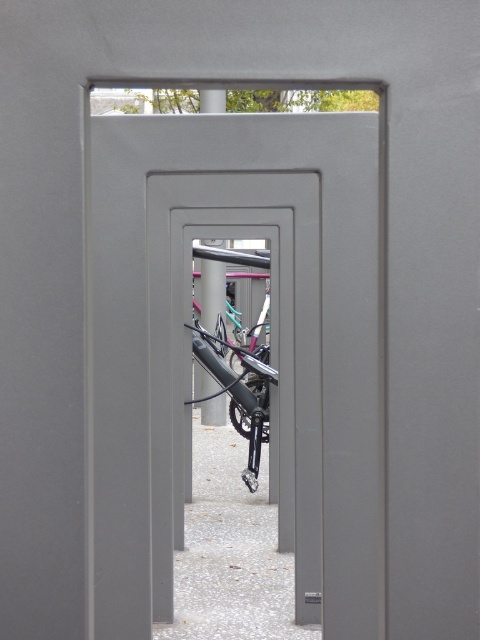
Does shiny metallic bicycle at center come in front of matte black bike at center?

Yes, shiny metallic bicycle at center is closer to the viewer.

Is shiny metallic bicycle at center wider than matte black bike at center?

Yes, shiny metallic bicycle at center is wider than matte black bike at center.

Who is more forward, (254, 444) or (217, 416)?

Positioned in front is point (254, 444).

Locate an element on the screen. This screenshot has height=640, width=480. shiny metallic bicycle at center is located at coordinates (240, 388).